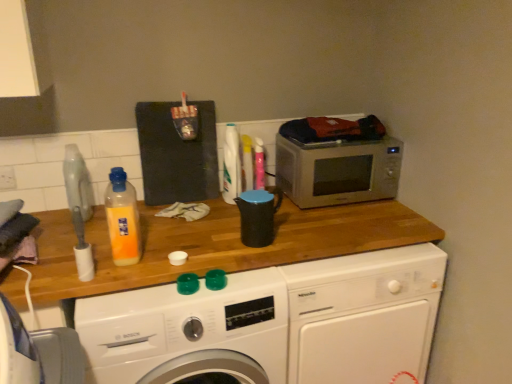
Question: Is translucent plastic bottle at center further to camera compared to black plastic kettle at center?

Choices:
 (A) no
 (B) yes

Answer: (A)

Question: Does translucent plastic bottle at center come in front of black plastic kettle at center?

Choices:
 (A) yes
 (B) no

Answer: (A)

Question: Is translucent plastic bottle at center turned away from black plastic kettle at center?

Choices:
 (A) yes
 (B) no

Answer: (B)

Question: Does translucent plastic bottle at center have a greater width compared to black plastic kettle at center?

Choices:
 (A) no
 (B) yes

Answer: (A)

Question: Can you confirm if translucent plastic bottle at center is shorter than black plastic kettle at center?

Choices:
 (A) yes
 (B) no

Answer: (B)

Question: Does point (372, 283) appear closer or farther from the camera than point (266, 220)?

Choices:
 (A) farther
 (B) closer

Answer: (A)

Question: In the image, is white glossy washing machine at center, the second washing machine viewed from the left, on the left side or the right side of black plastic kettle at center?

Choices:
 (A) right
 (B) left

Answer: (A)

Question: Do you think white glossy washing machine at center, positioned as the first washing machine in right-to-left order, is within black plastic kettle at center, or outside of it?

Choices:
 (A) outside
 (B) inside

Answer: (A)

Question: Considering the positions of white glossy washing machine at center, positioned as the first washing machine in right-to-left order, and black plastic kettle at center in the image, is white glossy washing machine at center, positioned as the first washing machine in right-to-left order, wider or thinner than black plastic kettle at center?

Choices:
 (A) wide
 (B) thin

Answer: (A)

Question: From a real-world perspective, is satin silver microwave at upper right physically located above or below white plastic power plugs and sockets at upper left?

Choices:
 (A) above
 (B) below

Answer: (B)

Question: Is satin silver microwave at upper right spatially inside white plastic power plugs and sockets at upper left, or outside of it?

Choices:
 (A) outside
 (B) inside

Answer: (A)

Question: In the image, is satin silver microwave at upper right positioned in front of or behind white plastic power plugs and sockets at upper left?

Choices:
 (A) behind
 (B) front

Answer: (A)

Question: Is satin silver microwave at upper right bigger or smaller than white plastic power plugs and sockets at upper left?

Choices:
 (A) big
 (B) small

Answer: (A)

Question: Looking at their shapes, would you say satin silver microwave at upper right is wider or thinner than white glossy washing machine at center, the second washing machine viewed from the left?

Choices:
 (A) thin
 (B) wide

Answer: (A)

Question: Is satin silver microwave at upper right in front of or behind white glossy washing machine at center, positioned as the first washing machine in right-to-left order, in the image?

Choices:
 (A) behind
 (B) front

Answer: (A)